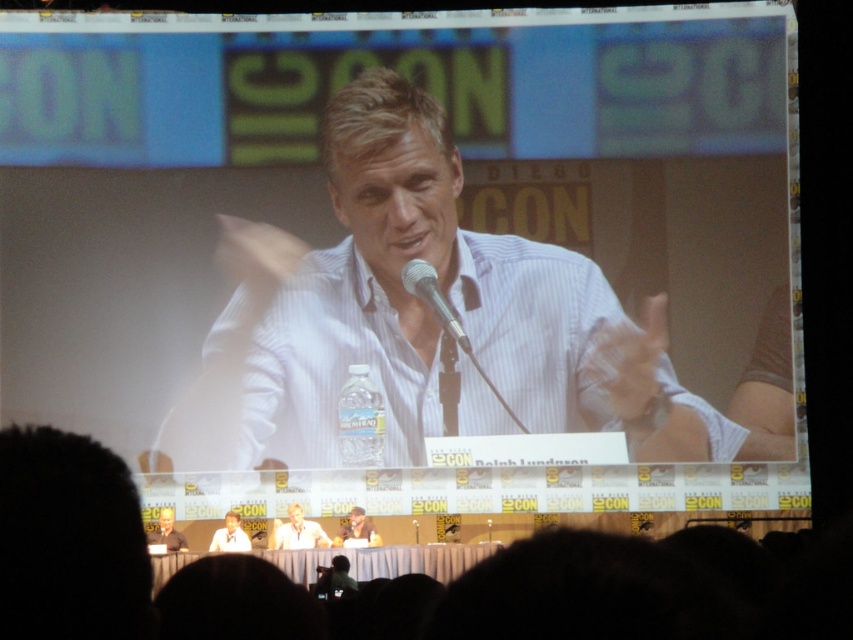
You are an attendee at Comic Con trying to take a photo of the panelists. You notice the white striped shirt at center and the smooth brown leather jacket at center. Which one is closer to the camera?

The white striped shirt at center is above the smooth brown leather jacket at center, so it is closer to the camera.

You are organizing a panel discussion at Comic Con and need to place a 2.5 meter long banner between the light brown wood table at lower center and the smooth brown leather jacket at center. Will the banner fit between them?

The distance between the light brown wood table at lower center and the smooth brown leather jacket at center is 2.21 meters. Since the banner is 2.5 meters long, it will not fit between them as the space is shorter than the banner.

You are attending a panel discussion at Comic Con and want to take a photo of the point at coordinate (x=434, y=385). The venue has a rule that you must be at least 300 feet away from the subject to take a photo. Can you take the photo from your current position?

The point at coordinate (x=434, y=385) is 306.95 feet away from the viewer, which is more than the required 300 feet. Therefore, you can take the photo from your current position.